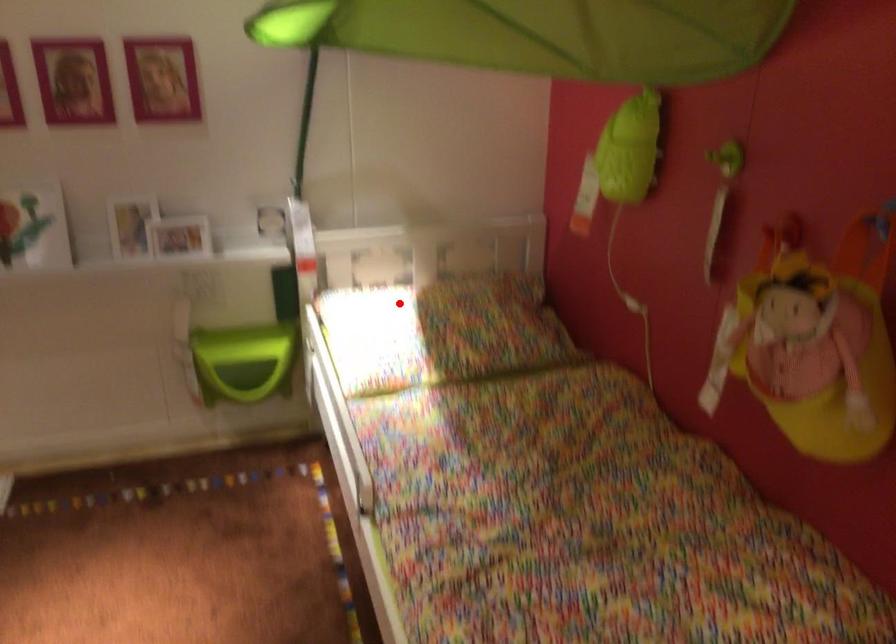
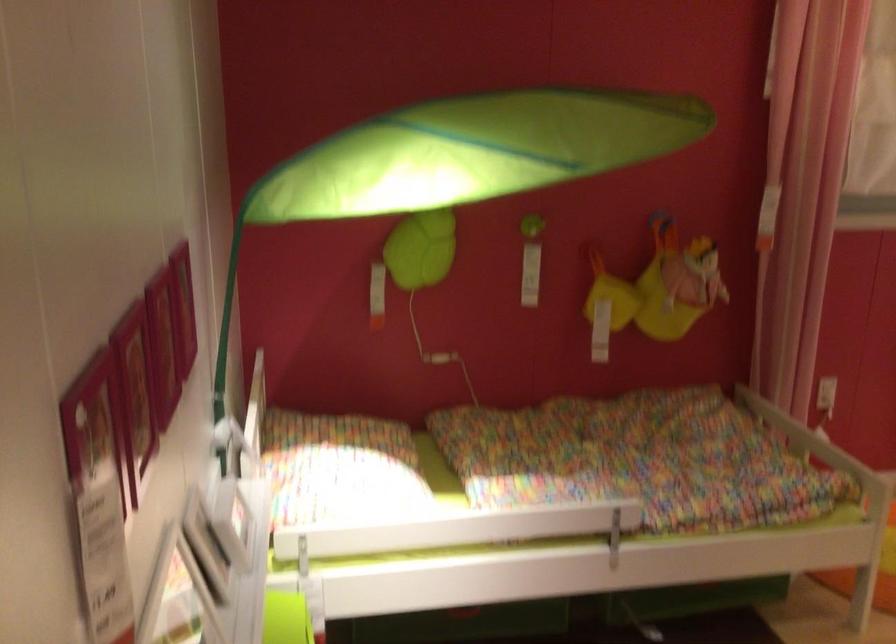
Where in the second image is the point corresponding to the highlighted location from the first image?

(339, 468)